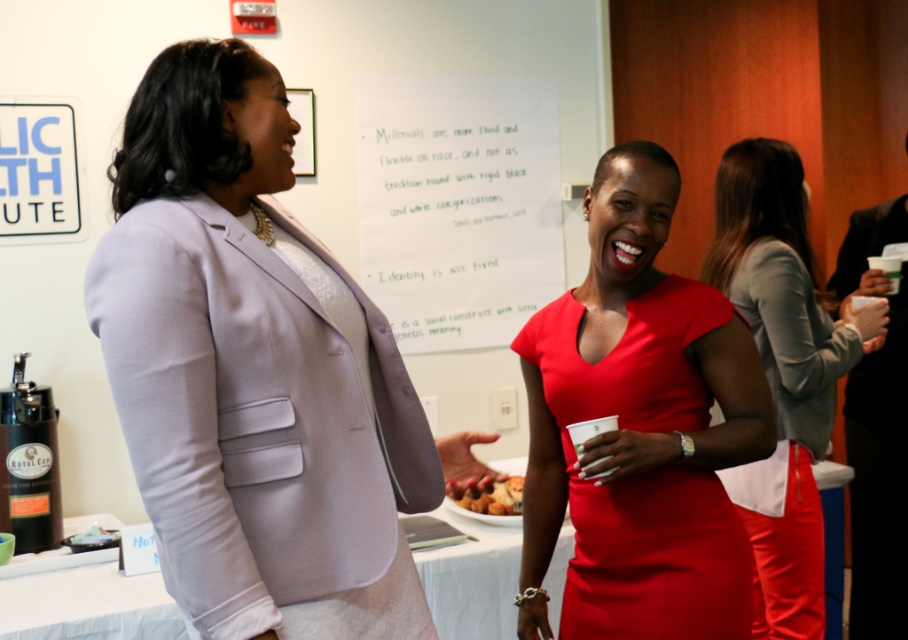
You are organizing a presentation and need to place the white paper at center and the black smooth suit at right on a table. Which object should you place first to ensure proper positioning?

The white paper at center should be placed first because it is positioned over the black smooth suit at right, meaning it needs to be placed on top of it.

You are a photographer standing at the camera position. You want to take a closeup shot of the matte gray blazer at center without moving the camera. Is it possible to do so with a standard zoom lens that has a maximum zoom range of 1.8 meters?

The matte gray blazer at center is 1.78 meters from the camera, which is within the 1.8 meters maximum zoom range. Therefore, you can take a closeup shot of the matte gray blazer at center without moving the camera.

You are standing at the entrance of the room and want to approach the matte red dress at center. Based on its position coordinates, which direction should you move to reach it?

The matte red dress at center is located at coordinates point (644, 476), so you should move towards the lower right direction from the entrance to reach it.